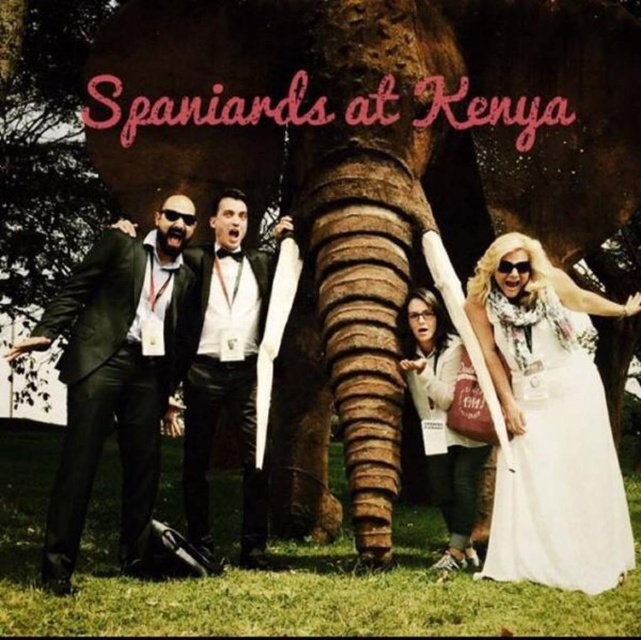
Question: Among these points, which one is farthest from the camera?

Choices:
 (A) (520, 285)
 (B) (54, 305)
 (C) (445, 484)

Answer: (C)

Question: Can you confirm if white satin dress at right is wider than white matte jacket at center?

Choices:
 (A) yes
 (B) no

Answer: (A)

Question: Which object is farther from the camera taking this photo?

Choices:
 (A) black matte suit at left
 (B) white satin dress at right
 (C) black leather suit at center

Answer: (C)

Question: Can you confirm if white satin dress at right is smaller than black matte suit at left?

Choices:
 (A) yes
 (B) no

Answer: (B)

Question: Estimate the real-world distances between objects in this image. Which object is closer to the black leather suit at center?

Choices:
 (A) black matte suit at left
 (B) white matte jacket at center
 (C) white satin dress at right

Answer: (A)

Question: Is white satin dress at right below black leather suit at center?

Choices:
 (A) no
 (B) yes

Answer: (B)